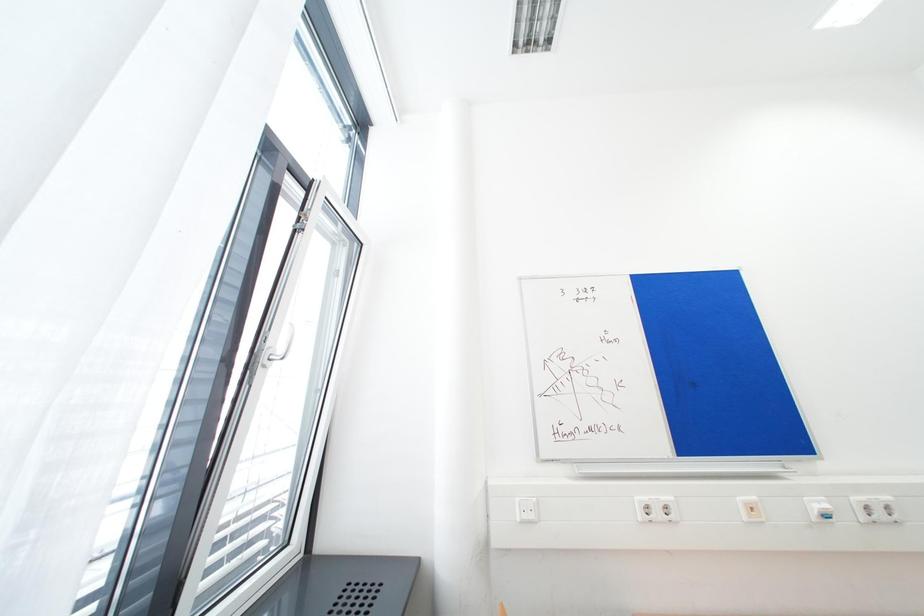
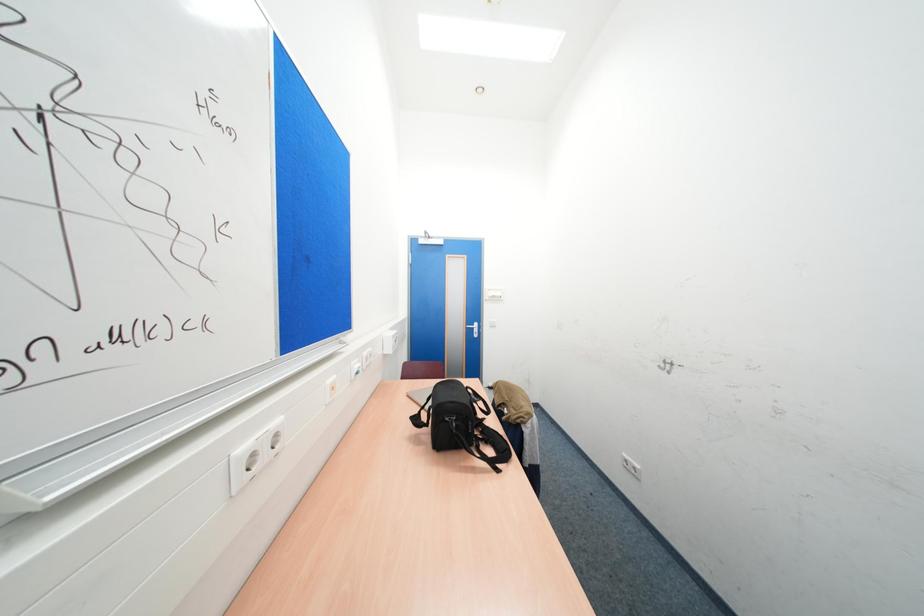
Question: The camera is either moving clockwise (left) or counter-clockwise (right) around the object. The first image is from the beginning of the video and the second image is from the end. Is the camera moving left or right when shooting the video?

Choices:
 (A) Left
 (B) Right

Answer: (A)